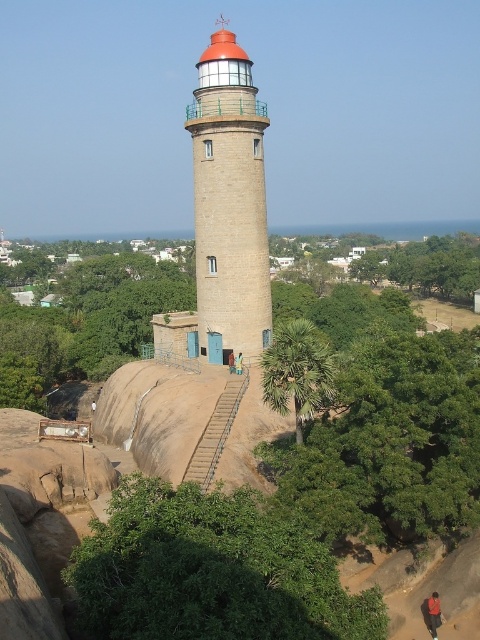
You are standing at the base of the beige stone lighthouse at center and want to look down to see the dark red fabric pants at lower right. Is the lighthouse blocking your view of the pants?

The beige stone lighthouse at center is further to the viewer than the dark red fabric pants at lower right, so the lighthouse is closer to you. This means the lighthouse might block your view of the pants located further away at lower right.

You are a photographer planning to take a wide shot of the beige stone lighthouse at center and the dark red fabric pants at lower right. Which object should you focus on first if you want to ensure both are in the frame without moving the camera?

You should focus on the beige stone lighthouse at center first because it is larger in size than the dark red fabric pants at lower right, making it more prominent in the frame.

You are standing at the base of the lighthouse and want to take a photo of the lighthouse. The camera you are using has a maximum zoom range of 50 feet. Is the point at coordinate point (163,600) within the camera range?

The point at coordinate point (163,600) is 57.07 feet away from the camera. Since the camera has a maximum zoom range of 50 feet, the point is outside the camera range.